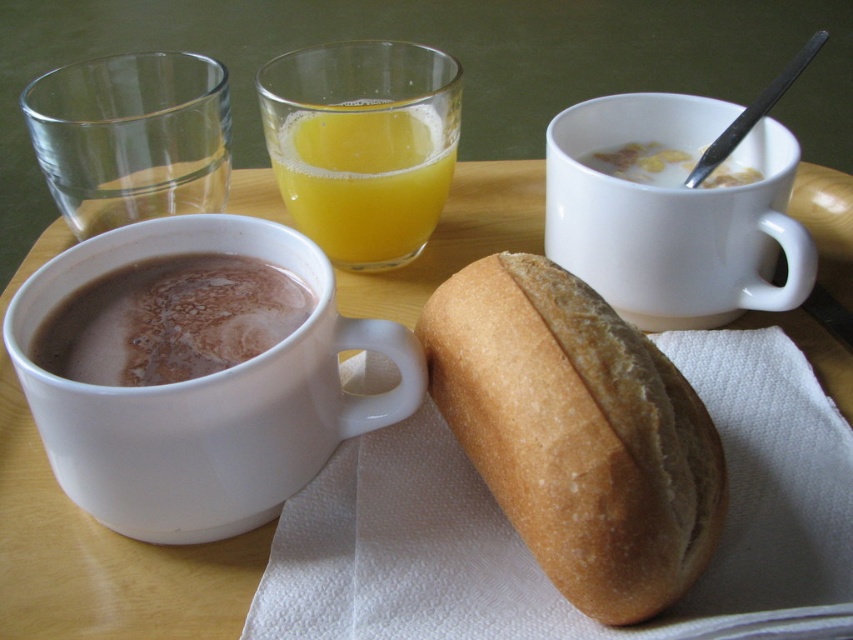
You are trying to decide which of the two white glossy mugs to use for your coffee. The white glossy mug at left and the white glossy mug at upper center are both available. Based on their sizes, which one can hold more liquid?

The white glossy mug at left might be wider than the white glossy mug at upper center, so it can potentially hold more liquid if its height is sufficient. However, without knowing the height, we can only confirm that the width suggests it could have a larger capacity.

You are setting up a breakfast tray and want to place a small saucer between the white glossy mug at upper center and the translucent glass orange juice at center. Based on their widths, will the saucer fit between them without overlapping either?

The white glossy mug at upper center might be wider than the translucent glass orange juice at center, so there may not be enough space for the saucer between them without overlapping. It is uncertain and depends on the exact widths.

You are a waiter carrying a tray of items. You need to place the golden brown crusty bread at center and the white glossy mug at left on the table. According to the image, which item should you place first to ensure proper positioning?

The golden brown crusty bread at center should be placed first because it is in front of the white glossy mug at left, meaning it needs to be positioned closer to the front of the table before placing the mug behind it.